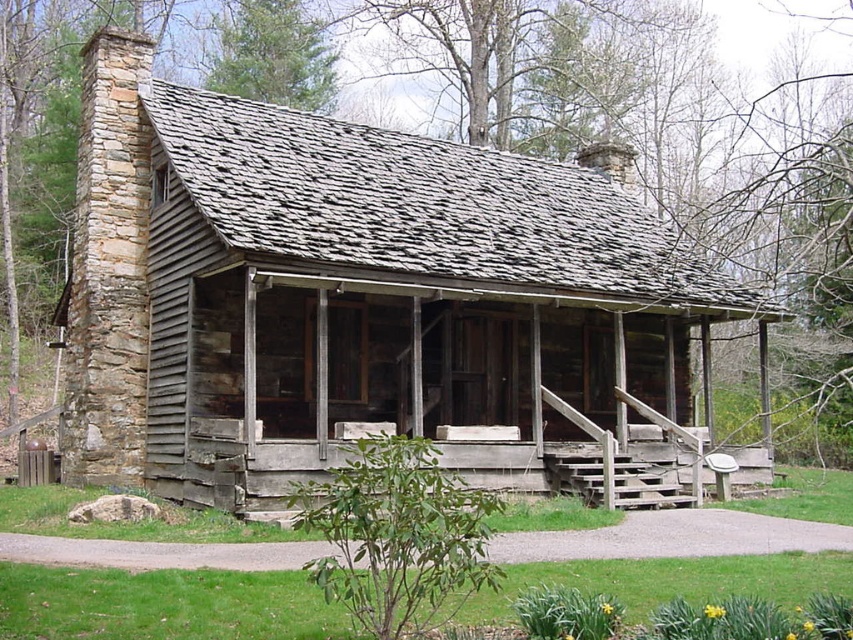
Question: Which point appears farthest from the camera in this image?

Choices:
 (A) (601, 468)
 (B) (296, 451)

Answer: (A)

Question: From the image, what is the correct spatial relationship of rustic wood cabin at center in relation to weathered wood porch at center?

Choices:
 (A) below
 (B) above

Answer: (B)

Question: Can you confirm if rustic wood cabin at center is bigger than weathered wood porch at center?

Choices:
 (A) yes
 (B) no

Answer: (A)

Question: Does rustic wood cabin at center come behind weathered wood porch at center?

Choices:
 (A) no
 (B) yes

Answer: (B)

Question: Among these objects, which one is nearest to the camera?

Choices:
 (A) rustic wood cabin at center
 (B) weathered wood porch at center

Answer: (B)